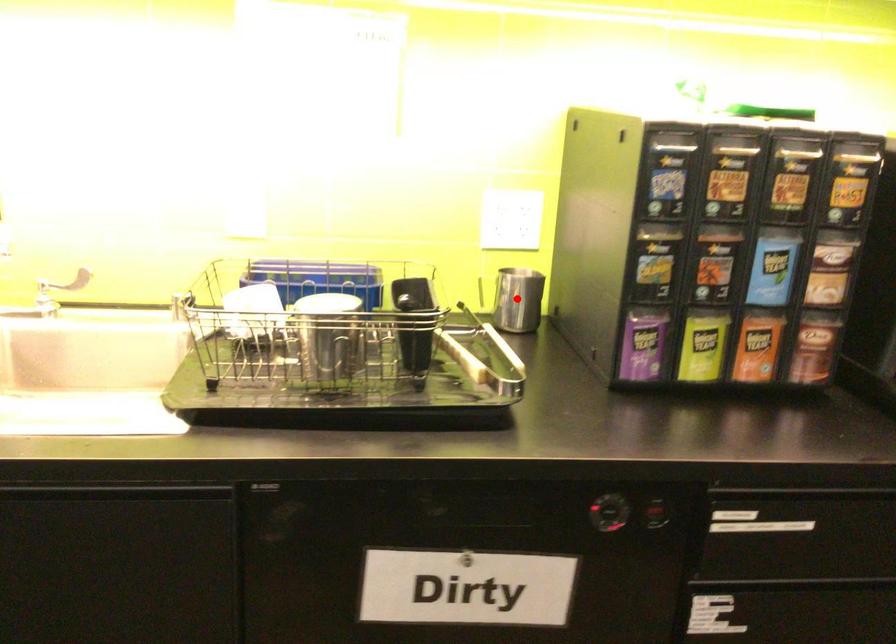
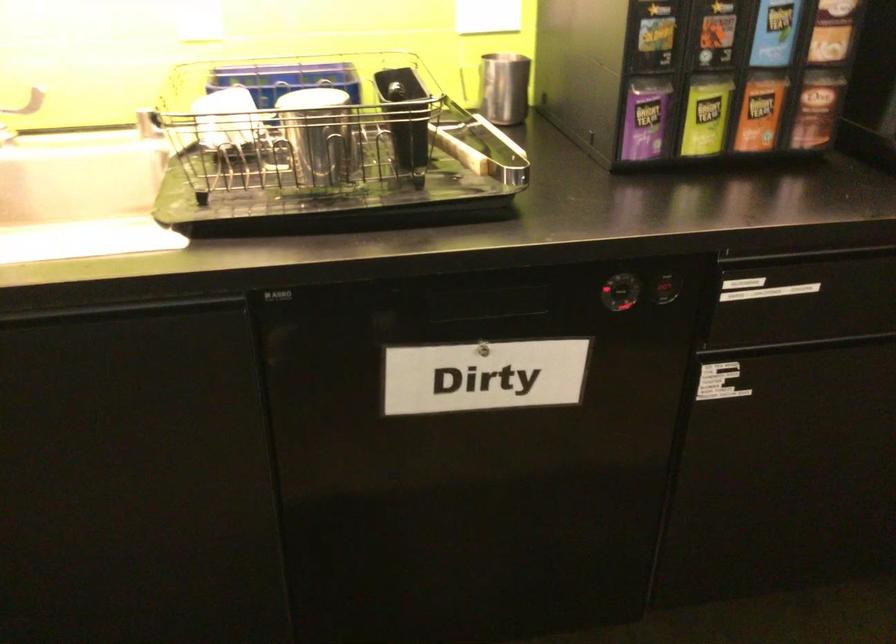
In the second image, find the point that corresponds to the highlighted location in the first image.

(504, 88)